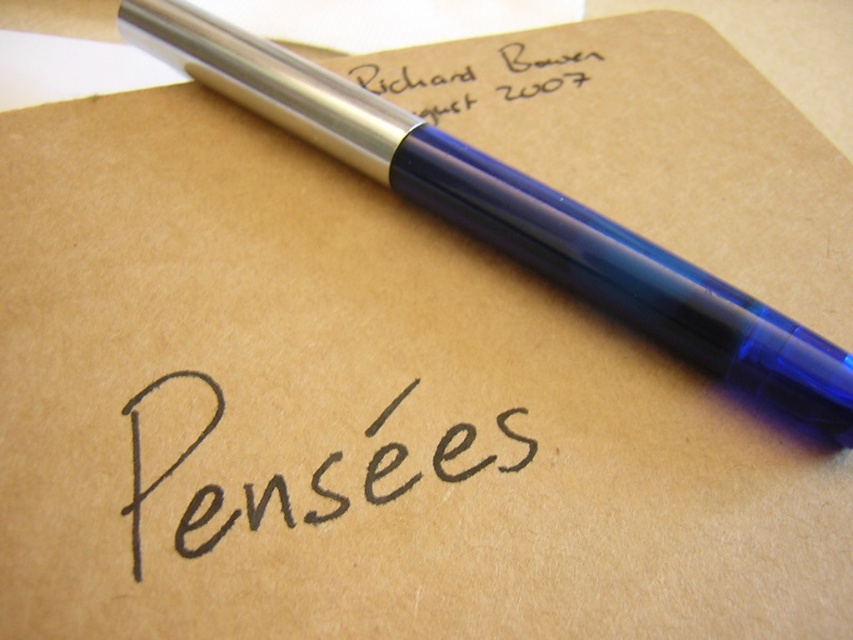
You are an artist who needs to place a sticker exactly at the center of the paper. You see the transparent blue pen at upper center. Where should you place the sticker relative to the pen?

The sticker should be placed below the transparent blue pen at upper center since the pen is located at coordinates higher than the center point of the paper.

You are organizing a stationery collection and need to determine if the transparent blue pen at upper center can fit into a storage compartment designed for items narrower than the black ink writing at center. Based on their widths, can the pen fit?

The transparent blue pen at upper center is wider than the black ink writing at center, so it cannot fit into a storage compartment designed for items narrower than the black ink writing at center.

You are organizing a desk and need to place the transparent blue pen at upper center and the silver metallic pen at upper right. According to the image, which pen is positioned higher on the paper?

The silver metallic pen at upper right is positioned higher on the paper than the transparent blue pen at upper center.